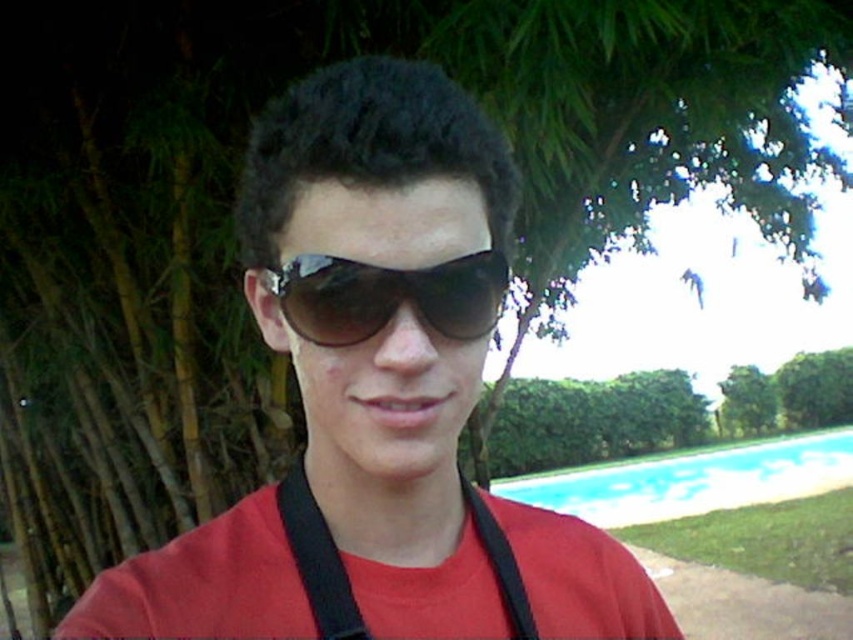
Can you confirm if blue smooth water at lower right is positioned below sunglasses at center?

Yes, blue smooth water at lower right is below sunglasses at center.

From the picture: Does blue smooth water at lower right have a greater height compared to sunglasses at center?

Yes, blue smooth water at lower right is taller than sunglasses at center.

Which is in front, point (732, 474) or point (380, 317)?

Point (380, 317)

Find the location of `blue smooth water at lower right`. blue smooth water at lower right is located at coordinates (693, 480).

Does matte black sunglasses at center have a lesser width compared to sunglasses at center?

Result: No.

The image size is (853, 640). I want to click on matte black sunglasses at center, so click(376, 397).

Is point (543, 532) less distant than point (428, 284)?

No, it is not.

At what (x,y) coordinates should I click in order to perform the action: click on matte black sunglasses at center. Please return your answer as a coordinate pair (x, y). This screenshot has width=853, height=640. Looking at the image, I should click on (376, 397).

Is matte black sunglasses at center to the right of blue smooth water at lower right from the viewer's perspective?

No, matte black sunglasses at center is not to the right of blue smooth water at lower right.

Where is `matte black sunglasses at center`? matte black sunglasses at center is located at coordinates (376, 397).

Locate an element on the screen. matte black sunglasses at center is located at coordinates pyautogui.click(x=376, y=397).